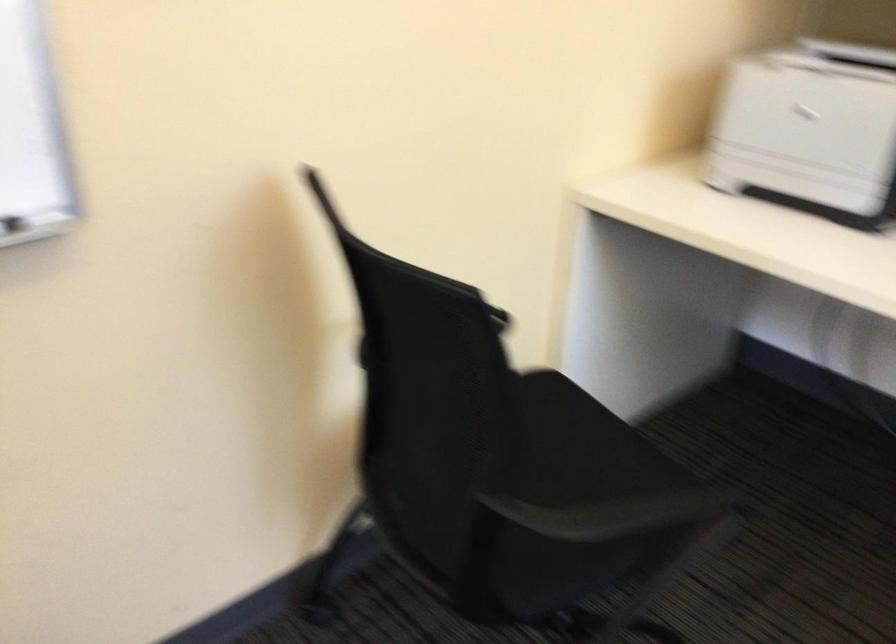
Describe the element at coordinates (579, 448) in the screenshot. Image resolution: width=896 pixels, height=644 pixels. I see `the chair sitting surface` at that location.